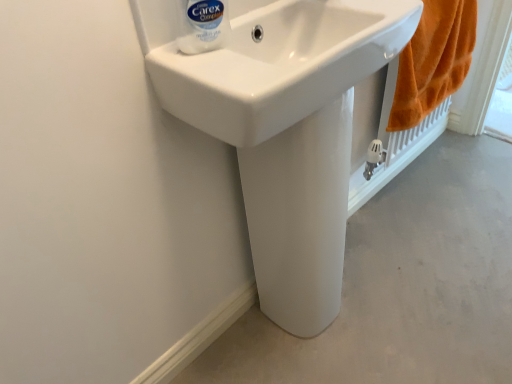
The width and height of the screenshot is (512, 384). Find the location of `vacant space to the right of white glossy pedestal at center`. vacant space to the right of white glossy pedestal at center is located at coordinates (373, 295).